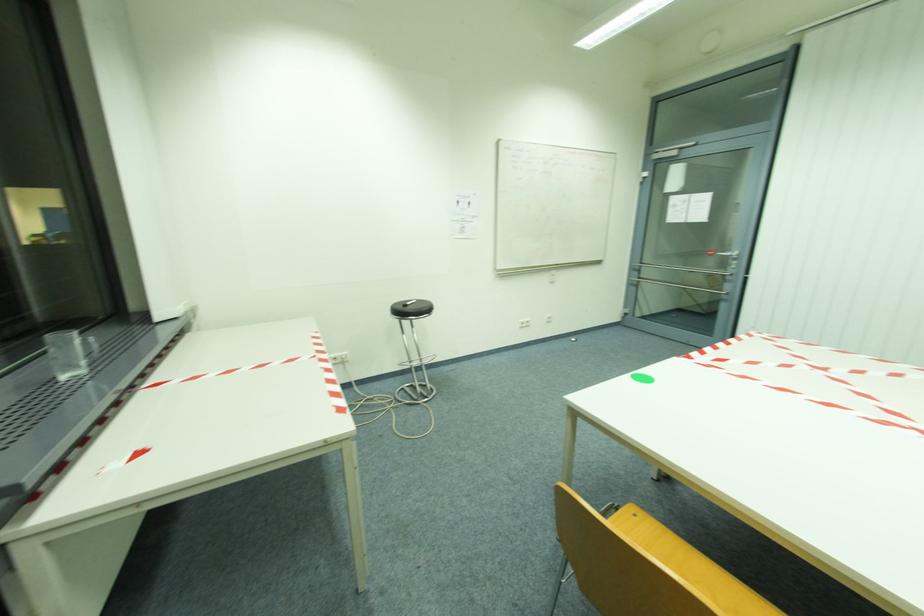
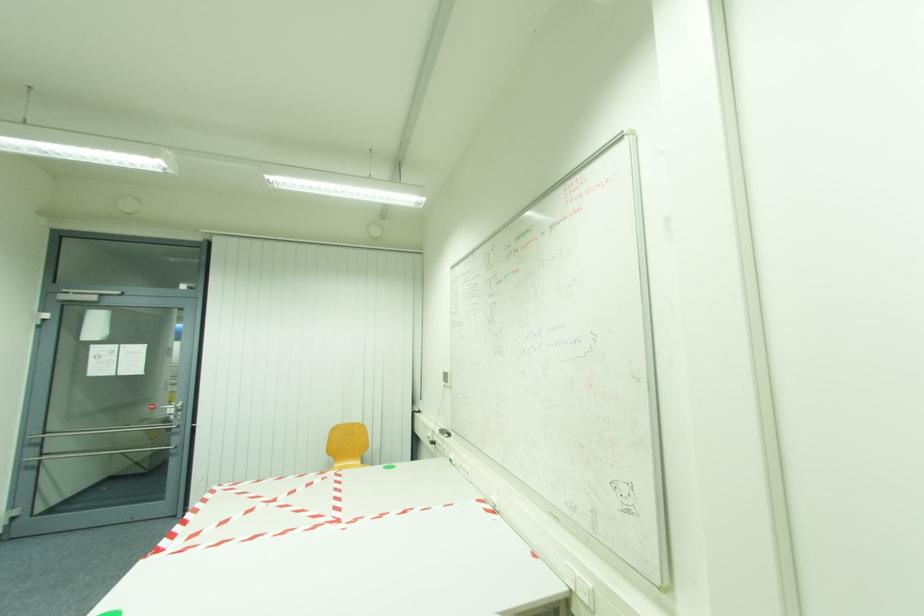
Question: How did the camera likely rotate?

Choices:
 (A) Left
 (B) Right
 (C) Up
 (D) Down

Answer: (B)